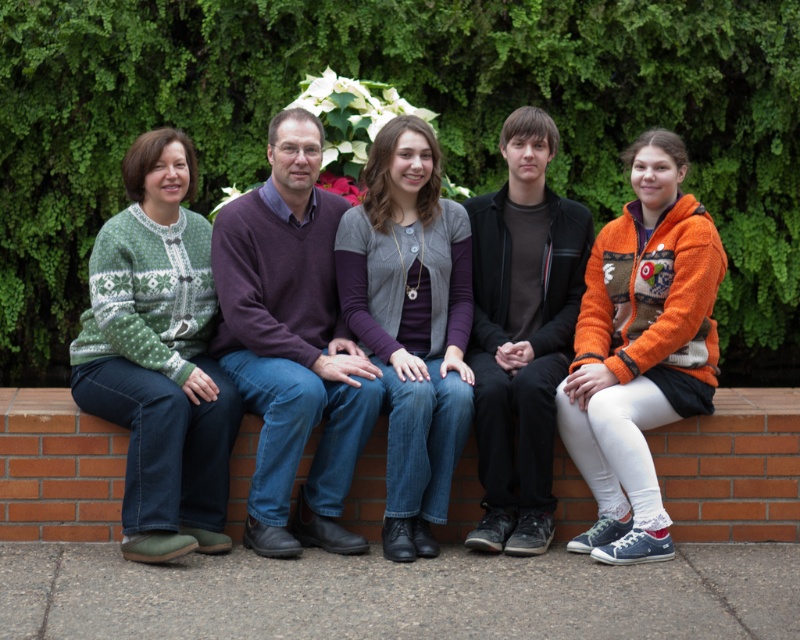
Consider the image. You are standing in a park and see two people sitting on a brick ledge. One is wearing a green knitted sweater at left and the other an orange fuzzy sweater at right. Which person is sitting more to the left?

The green knitted sweater at left is more to the left than the orange fuzzy sweater at right.

You are a fashion designer observing the group and want to suggest a matching accessory for each person. Since the green knitted sweater at left is larger in size than the orange fuzzy sweater at right, which sweater would you recommend pairing with a larger scarf to complement its size?

The green knitted sweater at left is larger in size than the orange fuzzy sweater at right, so pairing it with a larger scarf would be more appropriate to complement its size.

You are standing in front of the scene with the green knitted sweater at left. If you want to take a closer look at the sweater without moving, which direction should you move your head to see it better?

Since the green knitted sweater at left is 5.39 meters away from the camera, you should move your head to the left to get a better view of it.